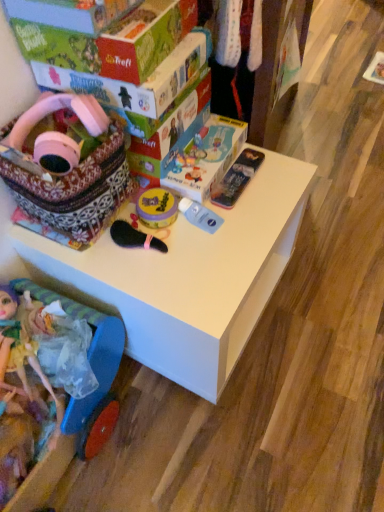
The width and height of the screenshot is (384, 512). I want to click on free spot to the right of transparent plastic bottle at center, positioned as the fifth toy in left-to-right order, so click(264, 209).